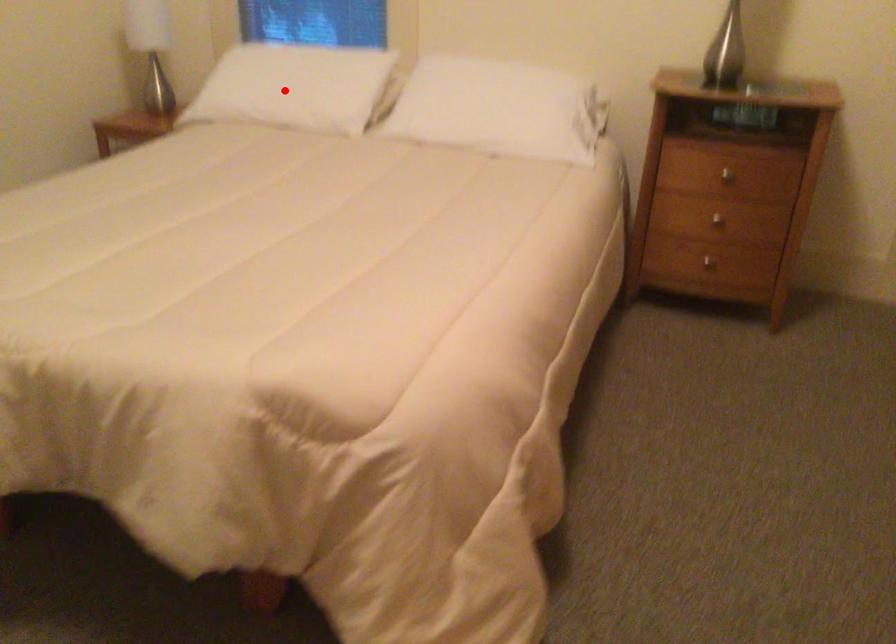
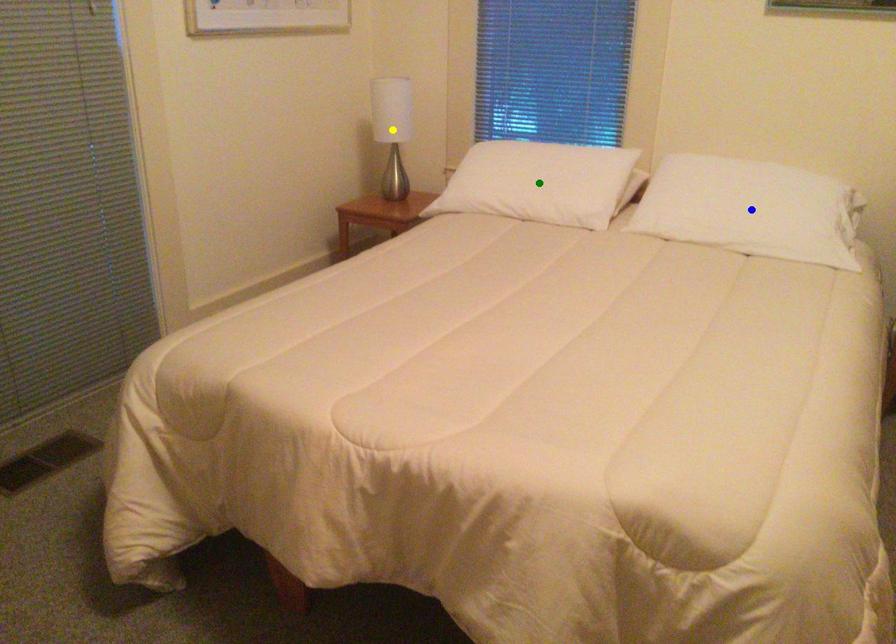
Question: I am providing you with two images of the same scene from different viewpoints. A red point is marked on the first image. You are given multiple points on the second image. Which point in image 2 represents the same 3d spot as the red point in image 1?

Choices:
 (A) yellow point
 (B) blue point
 (C) green point

Answer: (C)